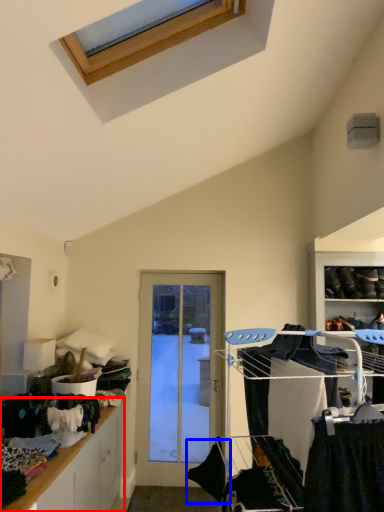
Question: Among these objects, which one is nearest to the camera, cabinetry (highlighted by a red box) or clothing (highlighted by a blue box)?

Choices:
 (A) cabinetry
 (B) clothing

Answer: (A)